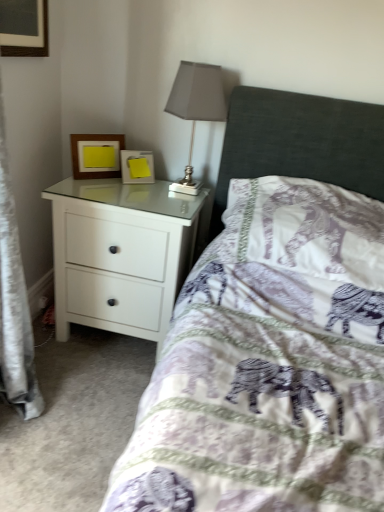
Question: Considering their positions, is purple elephant-patterned pillow at center located in front of or behind wooden picture frame at upper left, the second picture frame in the right-to-left sequence?

Choices:
 (A) front
 (B) behind

Answer: (A)

Question: Considering the positions of purple elephant-patterned pillow at center and wooden picture frame at upper left, placed as the first picture frame when sorted from left to right, in the image, is purple elephant-patterned pillow at center taller or shorter than wooden picture frame at upper left, placed as the first picture frame when sorted from left to right,?

Choices:
 (A) tall
 (B) short

Answer: (A)

Question: Which is nearer to the white glossy chest of drawers at left?

Choices:
 (A) matte gray lampshade at upper center
 (B) purple elephant-patterned pillow at center
 (C) yellow paper at upper left, which is counted as the first picture frame, starting from the right
 (D) wooden picture frame at upper left, the second picture frame in the right-to-left sequence

Answer: (C)

Question: Estimate the real-world distances between objects in this image. Which object is farther from the yellow paper at upper left, which is counted as the first picture frame, starting from the right?

Choices:
 (A) white glossy chest of drawers at left
 (B) wooden picture frame at upper left, the second picture frame in the right-to-left sequence
 (C) matte gray lampshade at upper center
 (D) purple elephant-patterned pillow at center

Answer: (D)